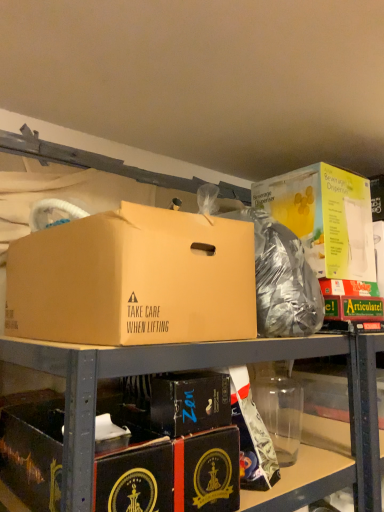
Question: Is black cardboard box at lower left, which is the 4th box from top to bottom, at the right side of black cardboard box at center, which ranks as the second box in bottom-to-top order?

Choices:
 (A) no
 (B) yes

Answer: (A)

Question: Is black cardboard box at lower left, which is the 4th box from top to bottom, wider than black cardboard box at center, acting as the third box starting from the top?

Choices:
 (A) no
 (B) yes

Answer: (B)

Question: Is black cardboard box at lower left, which is the 4th box from top to bottom, smaller than black cardboard box at center, which ranks as the second box in bottom-to-top order?

Choices:
 (A) yes
 (B) no

Answer: (B)

Question: Can you confirm if black cardboard box at lower left, marked as the first box in a bottom-to-top arrangement, is positioned to the left of black cardboard box at center, acting as the third box starting from the top?

Choices:
 (A) yes
 (B) no

Answer: (A)

Question: From the image's perspective, does black cardboard box at lower left, which is the 4th box from top to bottom, appear lower than black cardboard box at center, which ranks as the second box in bottom-to-top order?

Choices:
 (A) yes
 (B) no

Answer: (A)

Question: Considering the positions of brown cardboard box at center, the second box from the top, and black cardboard box at center, which ranks as the second box in bottom-to-top order, in the image, is brown cardboard box at center, the second box from the top, bigger or smaller than black cardboard box at center, which ranks as the second box in bottom-to-top order,?

Choices:
 (A) big
 (B) small

Answer: (A)

Question: From their relative heights in the image, would you say brown cardboard box at center, positioned as the third box in bottom-to-top order, is taller or shorter than black cardboard box at center, which ranks as the second box in bottom-to-top order?

Choices:
 (A) short
 (B) tall

Answer: (B)

Question: Is brown cardboard box at center, positioned as the third box in bottom-to-top order, inside the boundaries of black cardboard box at center, acting as the third box starting from the top, or outside?

Choices:
 (A) inside
 (B) outside

Answer: (B)

Question: From the image's perspective, is brown cardboard box at center, positioned as the third box in bottom-to-top order, located above or below black cardboard box at center, which ranks as the second box in bottom-to-top order?

Choices:
 (A) below
 (B) above

Answer: (B)

Question: Does point (258, 222) appear closer or farther from the camera than point (173, 393)?

Choices:
 (A) farther
 (B) closer

Answer: (A)

Question: Looking at their shapes, would you say shiny metallic bag at center is wider or thinner than black cardboard box at center, acting as the third box starting from the top?

Choices:
 (A) wide
 (B) thin

Answer: (A)

Question: Is shiny metallic bag at center in front of or behind black cardboard box at center, acting as the third box starting from the top, in the image?

Choices:
 (A) front
 (B) behind

Answer: (B)

Question: In terms of size, does shiny metallic bag at center appear bigger or smaller than black cardboard box at center, which ranks as the second box in bottom-to-top order?

Choices:
 (A) big
 (B) small

Answer: (A)

Question: From a real-world perspective, is shiny metallic bag at center above or below brown cardboard box at center, the second box from the top?

Choices:
 (A) below
 (B) above

Answer: (B)

Question: Is shiny metallic bag at center in front of or behind brown cardboard box at center, positioned as the third box in bottom-to-top order, in the image?

Choices:
 (A) front
 (B) behind

Answer: (B)